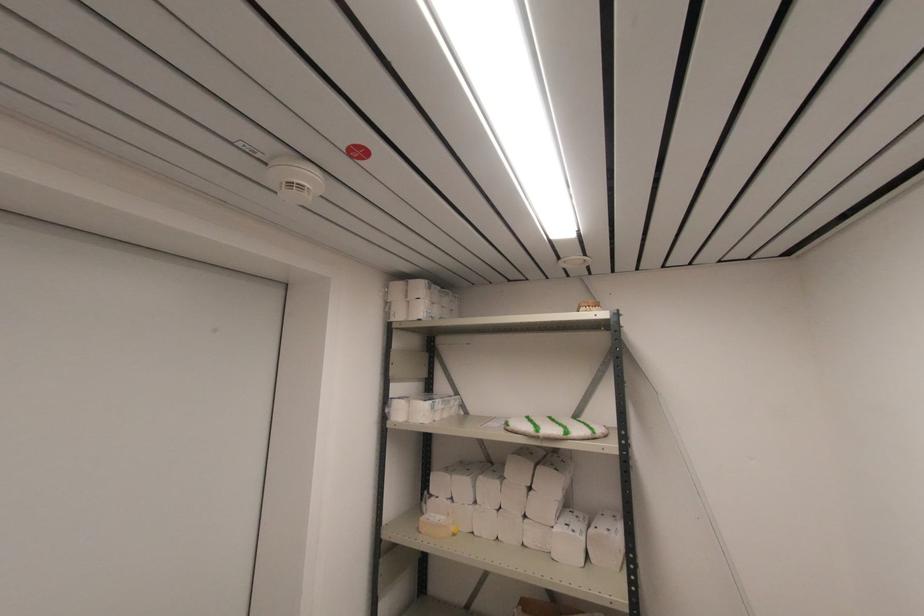
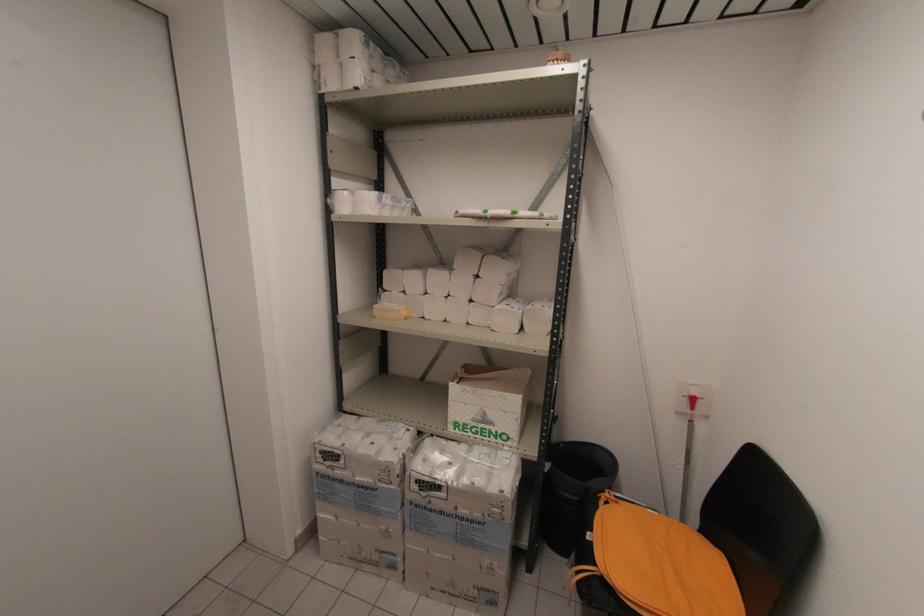
Question: In a continuous first-person perspective shot, in which direction is the camera moving?

Choices:
 (A) Left
 (B) Right
 (C) Forward
 (D) Backward

Answer: (B)